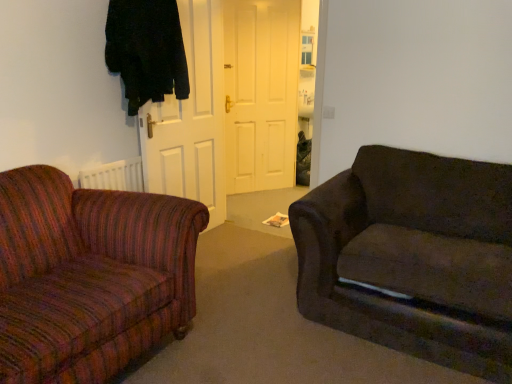
Question: Considering the positions of dark fabric couch at right and black fabric coat at upper left in the image, is dark fabric couch at right wider or thinner than black fabric coat at upper left?

Choices:
 (A) wide
 (B) thin

Answer: (A)

Question: In the image, is dark fabric couch at right positioned in front of or behind black fabric coat at upper left?

Choices:
 (A) front
 (B) behind

Answer: (A)

Question: Which is farther from the white matte door at center, the first door viewed from the left?

Choices:
 (A) dark fabric couch at right
 (B) white matte door at center, positioned as the 2th door in front-to-back order
 (C) black fabric coat at upper left

Answer: (A)

Question: Which of these objects is positioned closest to the white matte door at center, which is the first door in back-to-front order?

Choices:
 (A) black fabric coat at upper left
 (B) dark fabric couch at right
 (C) white matte door at center, the first door viewed from the left

Answer: (C)